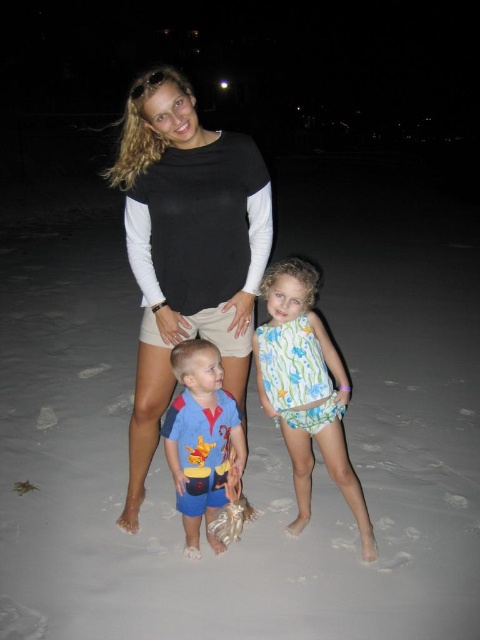
Question: Is floral print swimsuit at center behind blue cotton shirt at center?

Choices:
 (A) yes
 (B) no

Answer: (A)

Question: Does black cotton shirt at center have a larger size compared to blue cotton shirt at center?

Choices:
 (A) no
 (B) yes

Answer: (B)

Question: Which of the following is the closest to the observer?

Choices:
 (A) black cotton shirt at center
 (B) blue cotton shirt at center

Answer: (A)

Question: Does black cotton shirt at center have a greater width compared to floral print swimsuit at center?

Choices:
 (A) no
 (B) yes

Answer: (B)

Question: Which point is closer to the camera?

Choices:
 (A) blue cotton shirt at center
 (B) floral print swimsuit at center

Answer: (A)

Question: Which of the following is the closest to the observer?

Choices:
 (A) black cotton shirt at center
 (B) floral print swimsuit at center
 (C) blue cotton shirt at center

Answer: (A)